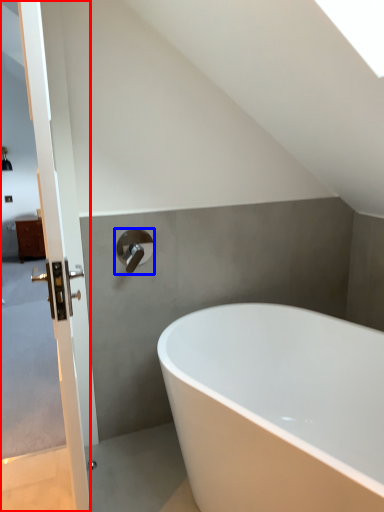
Question: Which point is closer to the camera, screen door (highlighted by a red box) or tap (highlighted by a blue box)?

Choices:
 (A) screen door
 (B) tap

Answer: (A)